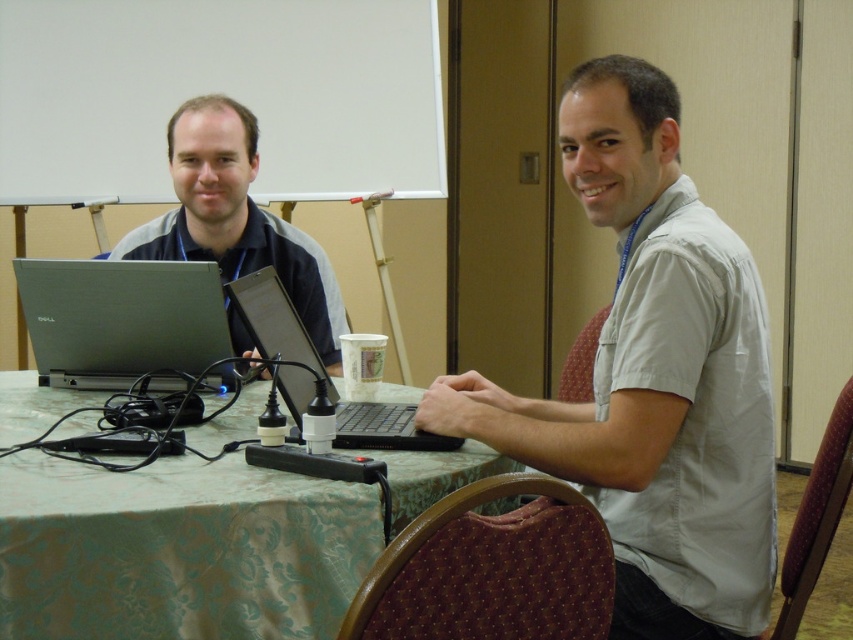
You are an IT technician who needs to access both the silver metallic laptop at center and the matte black laptop at left. Which one is closer to you from your current position?

The silver metallic laptop at center is positioned under matte black laptop at left, so the matte black laptop at left is closer to you.

Looking at this image, you are a delivery person who needs to place a small package on the table in the conference room. The package must be placed in front of the matte black laptop at left. Is the green fabric table at center a suitable location for placing the package?

Yes, the green fabric table at center is in front of the matte black laptop at left, so placing the package there would meet the requirement.

You are a person who wants to place a small notebook on the table. Where exactly should you place it so that it is closest to the point marked at coordinates (178,550)?

The green fabric table at center is located at point (178,550), so placing the notebook there would position it closest to that coordinate.